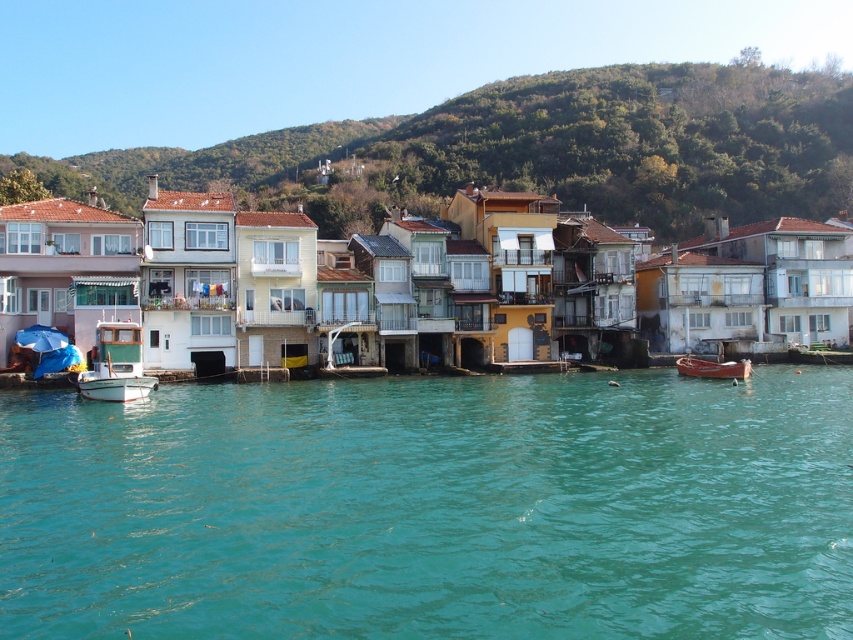
Question: Which of the following is the closest to the observer?

Choices:
 (A) (206, 580)
 (B) (699, 368)
 (C) (111, 376)
 (D) (700, 205)

Answer: (A)

Question: Can you confirm if green leafy hillside at upper center is positioned above wooden boat at lower right?

Choices:
 (A) yes
 (B) no

Answer: (A)

Question: Does green leafy hillside at upper center appear under white matte boat at left?

Choices:
 (A) no
 (B) yes

Answer: (A)

Question: Which object appears farthest from the camera in this image?

Choices:
 (A) white matte boat at left
 (B) green leafy hillside at upper center

Answer: (B)

Question: Is green leafy hillside at upper center to the left of white matte boat at left from the viewer's perspective?

Choices:
 (A) yes
 (B) no

Answer: (A)

Question: Which of the following is the closest to the observer?

Choices:
 (A) (119, 330)
 (B) (709, 372)
 (C) (223, 164)
 (D) (173, 412)

Answer: (D)